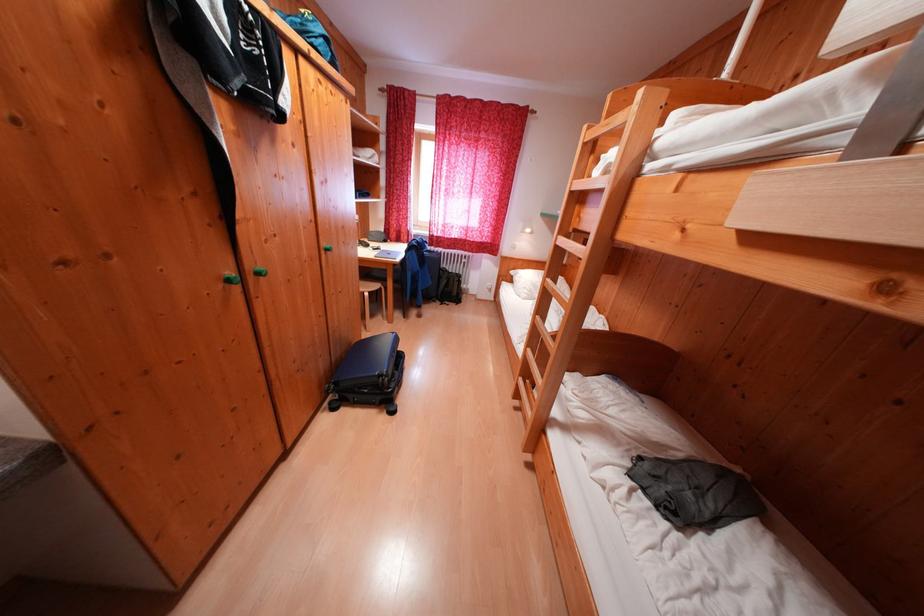
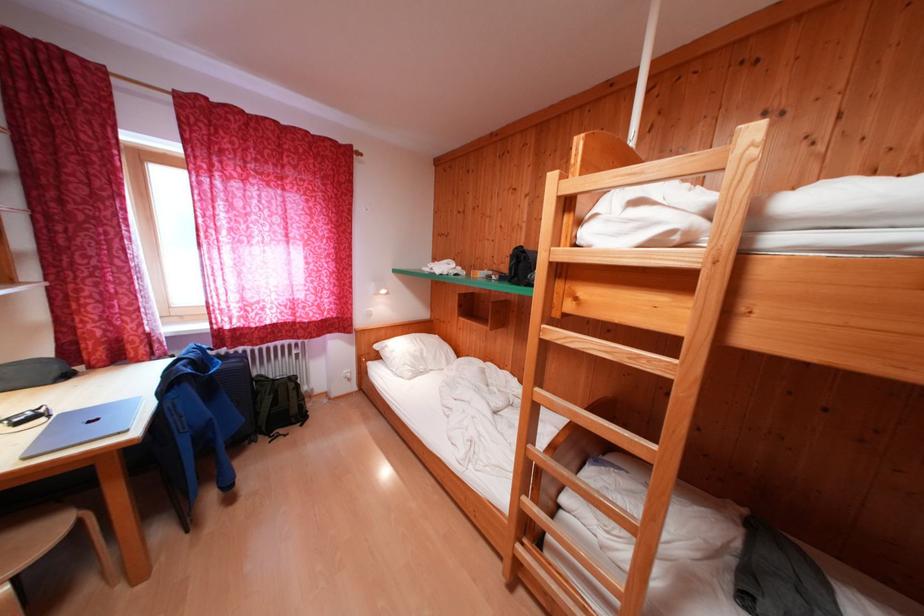
Where in the second image is the point corresponding to pixel 454 275 from the first image?

(271, 383)